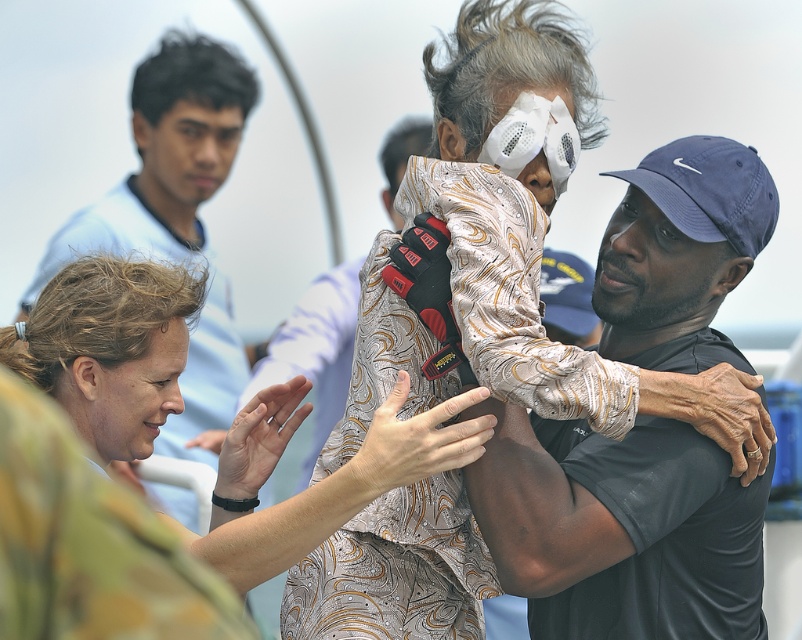
Does matte floral dress at center have a larger size compared to light blue shirt at upper left?

Incorrect, matte floral dress at center is not larger than light blue shirt at upper left.

Measure the distance between matte floral dress at center and light blue shirt at upper left.

39.77 feet

Does point (401, 442) lie behind point (215, 461)?

No, (401, 442) is in front of (215, 461).

This screenshot has height=640, width=802. Find the location of `matte floral dress at center`. matte floral dress at center is located at coordinates (108, 348).

Is light blue shirt at upper left positioned behind batik shirt at center?

That is False.

Does light blue shirt at upper left appear on the left side of batik shirt at center?

Indeed, light blue shirt at upper left is positioned on the left side of batik shirt at center.

The height and width of the screenshot is (640, 802). What do you see at coordinates (165, 157) in the screenshot? I see `light blue shirt at upper left` at bounding box center [165, 157].

Where is `light blue shirt at upper left`? The width and height of the screenshot is (802, 640). light blue shirt at upper left is located at coordinates (165, 157).

Between point (205, 563) and point (346, 340), which one is positioned in front?

Point (205, 563)

Is matte floral dress at center to the left of batik shirt at center from the viewer's perspective?

No, matte floral dress at center is not to the left of batik shirt at center.

What do you see at coordinates (108, 348) in the screenshot?
I see `matte floral dress at center` at bounding box center [108, 348].

Locate an element on the screen. Image resolution: width=802 pixels, height=640 pixels. matte floral dress at center is located at coordinates (108, 348).